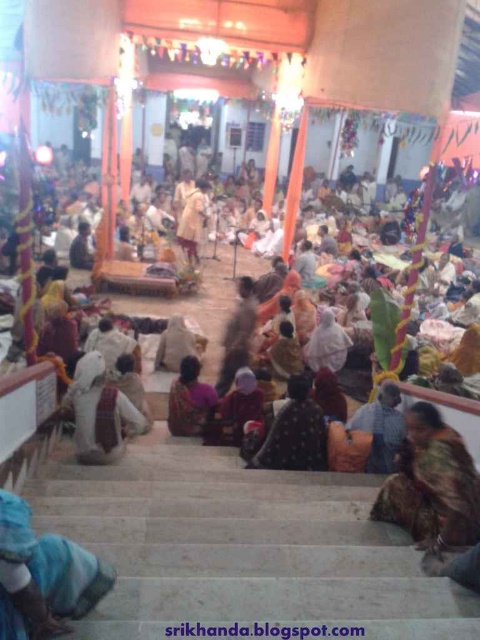
Does point (429, 403) come in front of point (324, 445)?

That is True.

Does multicolored fabric at lower right come behind dark brown fabric at center?

No, it is not.

Identify the location of multicolored fabric at lower right. This screenshot has width=480, height=640. (432, 483).

Can you confirm if multicolored fabric at lower right is smaller than white clothed person at center?

Correct, multicolored fabric at lower right occupies less space than white clothed person at center.

Is point (457, 458) less distant than point (142, 426)?

That is True.

Is point (437, 452) closer to viewer compared to point (116, 429)?

Yes, point (437, 452) is closer to viewer.

Where is `multicolored fabric at lower right`? Image resolution: width=480 pixels, height=640 pixels. multicolored fabric at lower right is located at coordinates (432, 483).

Is point (119, 456) closer to viewer compared to point (180, 412)?

Yes, it is.

Who is more distant from viewer, [119,404] or [193,419]?

Answer: Positioned behind is point [193,419].

Locate an element on the screen. Image resolution: width=480 pixels, height=640 pixels. white clothed person at center is located at coordinates (99, 412).